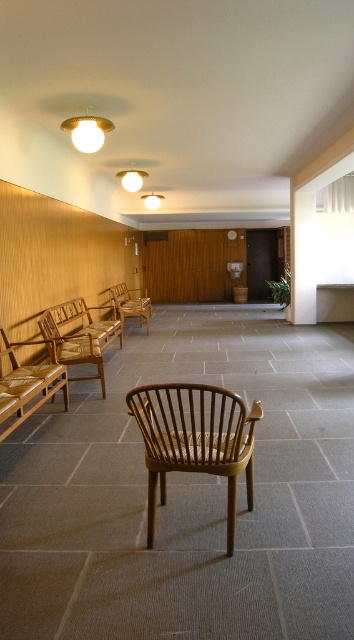
Is brown woven chair at center shorter than light brown wooden bench at left?

In fact, brown woven chair at center may be taller than light brown wooden bench at left.

Can you confirm if brown woven chair at center is positioned below light brown wooden bench at left?

Indeed, brown woven chair at center is positioned under light brown wooden bench at left.

Locate an element on the screen. The image size is (354, 640). brown woven chair at center is located at coordinates (195, 440).

Does brown woven chair at center have a larger size compared to wooden woven chair at left?

Indeed, brown woven chair at center has a larger size compared to wooden woven chair at left.

Which is more to the right, brown woven chair at center or wooden woven chair at left?

From the viewer's perspective, brown woven chair at center appears more on the right side.

Does point (201, 470) come in front of point (90, 378)?

Yes, point (201, 470) is in front of point (90, 378).

At what (x,y) coordinates should I click in order to perform the action: click on brown woven chair at center. Please return your answer as a coordinate pair (x, y). Image resolution: width=354 pixels, height=640 pixels. Looking at the image, I should click on (195, 440).

Between light brown wooden bench at left and brown woven bench at left, which one has more height?

brown woven bench at left is taller.

Who is higher up, light brown wooden bench at left or brown woven bench at left?

Positioned higher is brown woven bench at left.

Which is behind, point (21, 365) or point (134, 307)?

The point (134, 307) is behind.

You are a GUI agent. You are given a task and a screenshot of the screen. Output one action in this format:
    pyautogui.click(x=<x>, y=<y>)
    Task: Click on the light brown wooden bench at left
    
    Given the screenshot: What is the action you would take?
    pyautogui.click(x=27, y=381)